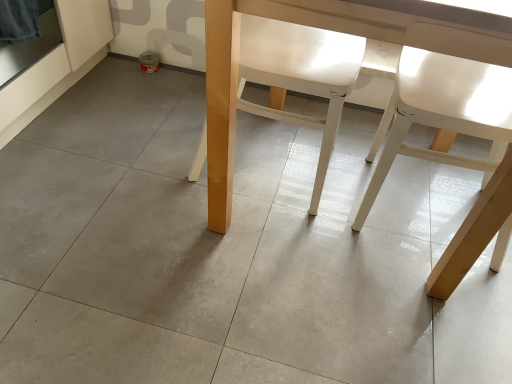
Question: Considering the positions of white matte chair at right, the second chair positioned from the left, and matte wood table at center in the image, is white matte chair at right, the second chair positioned from the left, bigger or smaller than matte wood table at center?

Choices:
 (A) small
 (B) big

Answer: (A)

Question: Would you say white matte chair at right, the second chair positioned from the left, is to the left or to the right of matte wood table at center in the picture?

Choices:
 (A) left
 (B) right

Answer: (B)

Question: Considering the real-world distances, which object is closest to the matte wood table at center?

Choices:
 (A) white matte chair at center, the 2th chair viewed from the right
 (B) white matte chair at right, which appears as the 1th chair when viewed from the right

Answer: (A)

Question: Estimate the real-world distances between objects in this image. Which object is farther from the white matte chair at center, the 2th chair viewed from the right?

Choices:
 (A) matte wood table at center
 (B) white matte chair at right, which appears as the 1th chair when viewed from the right

Answer: (B)